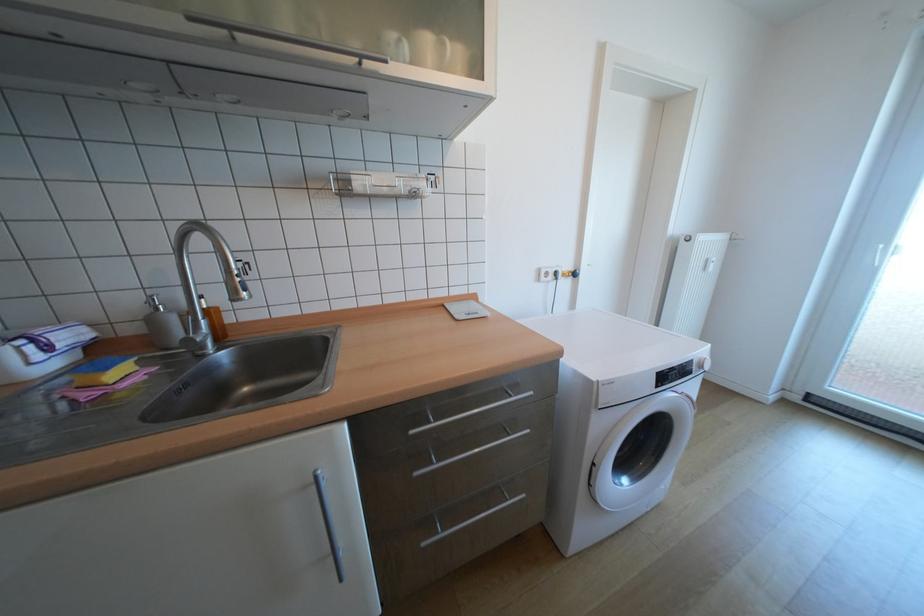
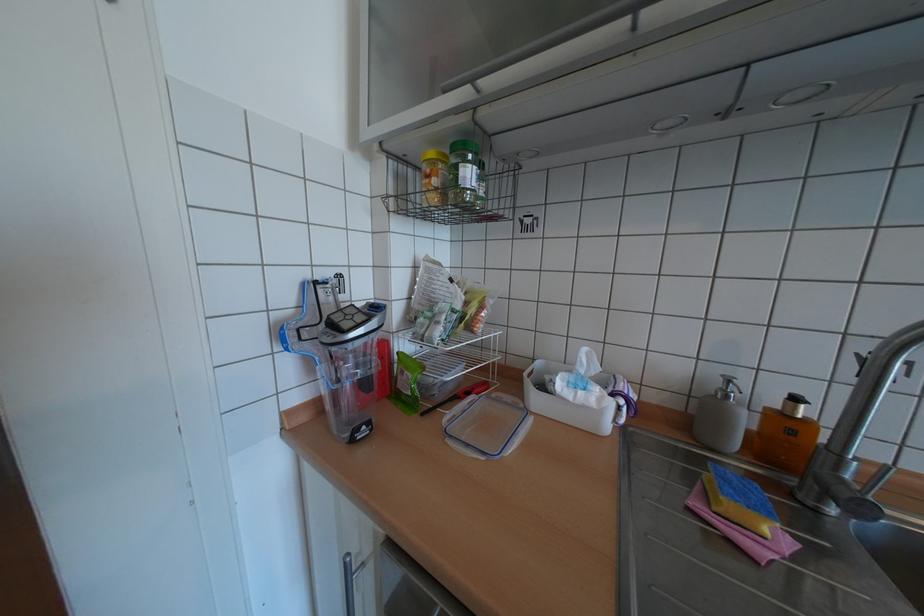
In the second image, find the point that corresponds to (x=84, y=386) in the first image.

(723, 508)